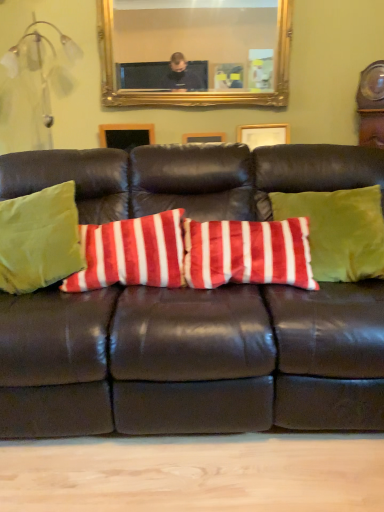
Question: From a real-world perspective, relative to velvet green pillow at center, placed as the first pillow when sorted from right to left, is velvety red and white striped pillow at center, the second pillow in the right-to-left sequence, vertically above or below?

Choices:
 (A) below
 (B) above

Answer: (A)

Question: Looking at their shapes, would you say velvety red and white striped pillow at center, which is the 2th pillow from left to right, is wider or thinner than velvet green pillow at center, placed as the first pillow when sorted from right to left?

Choices:
 (A) wide
 (B) thin

Answer: (A)

Question: Which of these objects is positioned closest to the velvety red and white striped pillow at center, which is the 2th pillow from left to right?

Choices:
 (A) gold-framed mirror at upper center
 (B) green velvet pillow at left, the 1th pillow in the left-to-right sequence
 (C) velvet green pillow at center, placed as the first pillow when sorted from right to left
 (D) matte brown leather couch at center

Answer: (B)

Question: Which object is positioned farthest from the green velvet pillow at left, the 1th pillow in the left-to-right sequence?

Choices:
 (A) velvety red and white striped pillow at center, which is the 2th pillow from left to right
 (B) gold-framed mirror at upper center
 (C) velvet green pillow at center, placed as the first pillow when sorted from right to left
 (D) matte brown leather couch at center

Answer: (B)